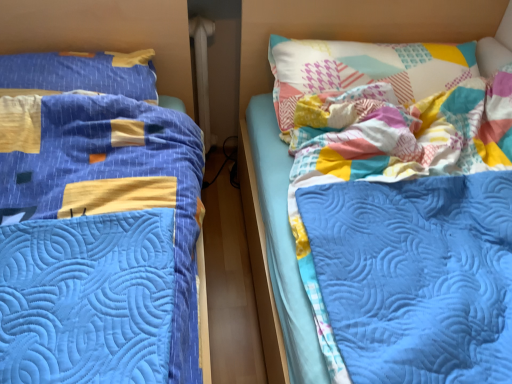
Question: Should I look upward or downward to see blue quilted bed at left?

Choices:
 (A) down
 (B) up

Answer: (B)

Question: Is patchwork fabric pillow at upper right, acting as the second pillow starting from the left, far away from blue quilted bed at left?

Choices:
 (A) yes
 (B) no

Answer: (B)

Question: Is patchwork fabric pillow at upper right, acting as the second pillow starting from the left, to the left of blue quilted bed at left from the viewer's perspective?

Choices:
 (A) no
 (B) yes

Answer: (A)

Question: Does patchwork fabric pillow at upper right, which is the 1th pillow in right-to-left order, appear on the right side of blue quilted bed at left?

Choices:
 (A) yes
 (B) no

Answer: (A)

Question: Is patchwork fabric pillow at upper right, which is the 1th pillow in right-to-left order, taller than blue quilted bed at left?

Choices:
 (A) yes
 (B) no

Answer: (B)

Question: Is patchwork fabric pillow at upper right, acting as the second pillow starting from the left, further to the viewer compared to blue quilted bed at left?

Choices:
 (A) no
 (B) yes

Answer: (B)

Question: Can you confirm if patchwork fabric pillow at upper right, acting as the second pillow starting from the left, is wider than blue quilted bed at left?

Choices:
 (A) yes
 (B) no

Answer: (B)

Question: Are blue quilted bed at left and patchwork fabric pillow at upper right, which is the 1th pillow in right-to-left order, making contact?

Choices:
 (A) yes
 (B) no

Answer: (B)

Question: Is the position of blue quilted bed at left less distant than that of patchwork fabric pillow at upper right, acting as the second pillow starting from the left?

Choices:
 (A) yes
 (B) no

Answer: (A)

Question: Is blue quilted bed at left behind patchwork fabric pillow at upper right, acting as the second pillow starting from the left?

Choices:
 (A) yes
 (B) no

Answer: (B)

Question: Is blue quilted bed at left completely or partially outside of patchwork fabric pillow at upper right, acting as the second pillow starting from the left?

Choices:
 (A) no
 (B) yes

Answer: (B)

Question: Is blue quilted bed at left facing away from patchwork fabric pillow at upper right, acting as the second pillow starting from the left?

Choices:
 (A) no
 (B) yes

Answer: (A)

Question: Considering the relative sizes of blue quilted bed at left and patchwork fabric pillow at upper right, which is the 1th pillow in right-to-left order, in the image provided, is blue quilted bed at left bigger than patchwork fabric pillow at upper right, which is the 1th pillow in right-to-left order,?

Choices:
 (A) yes
 (B) no

Answer: (A)

Question: From a real-world perspective, is patchwork fabric pillow at upper right, acting as the second pillow starting from the left, physically below blue quilted pillow at left, placed as the first pillow when sorted from left to right?

Choices:
 (A) no
 (B) yes

Answer: (B)